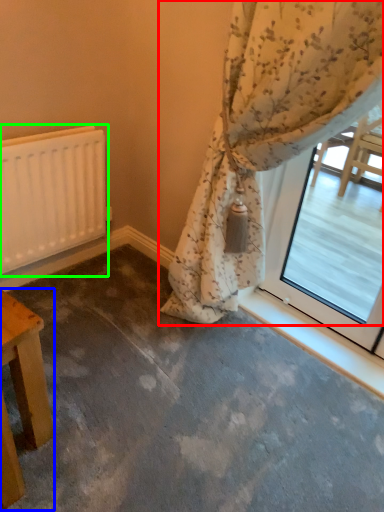
Question: Which is farther away from curtain (highlighted by a red box)? table (highlighted by a blue box) or radiator (highlighted by a green box)?

Choices:
 (A) table
 (B) radiator

Answer: (A)